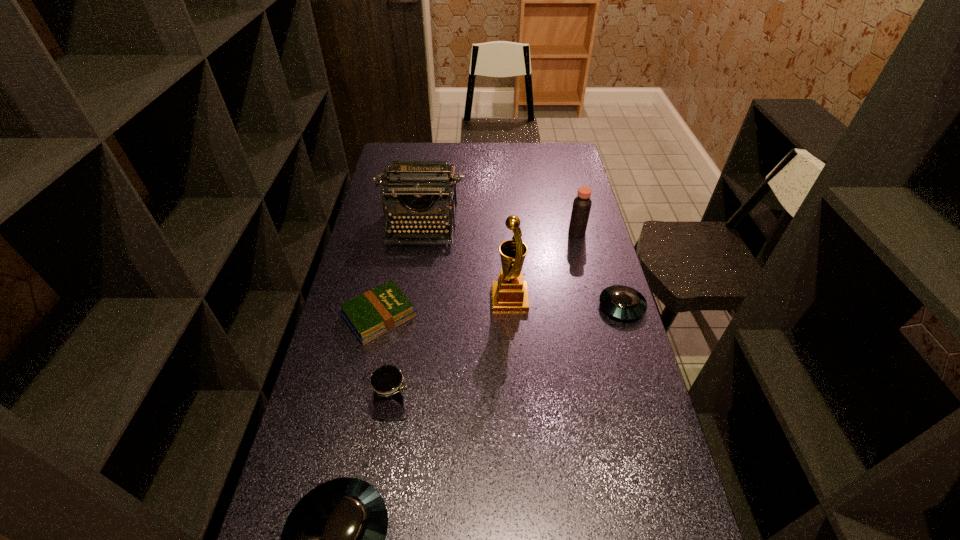
Locate which object is the third closest to the vinegar. Please provide its 2D coordinates. Your answer should be formatted as a tuple, i.e. [(x, y)], where the tuple contains the x and y coordinates of a point satisfying the conditions above.

[(425, 191)]

Locate an element on the screen. The width and height of the screenshot is (960, 540). the second closest object relative to the fourth tallest object is located at coordinates (376, 312).

Find the location of a particular element. The width and height of the screenshot is (960, 540). free location that satisfies the following two spatial constraints: 1. on the typing side of the typewriter; 2. on the right side of the farther saucer is located at coordinates (409, 306).

Find the location of a particular element. The height and width of the screenshot is (540, 960). vacant space that satisfies the following two spatial constraints: 1. on the typing side of the typewriter; 2. on the right side of the farther saucer is located at coordinates (409, 306).